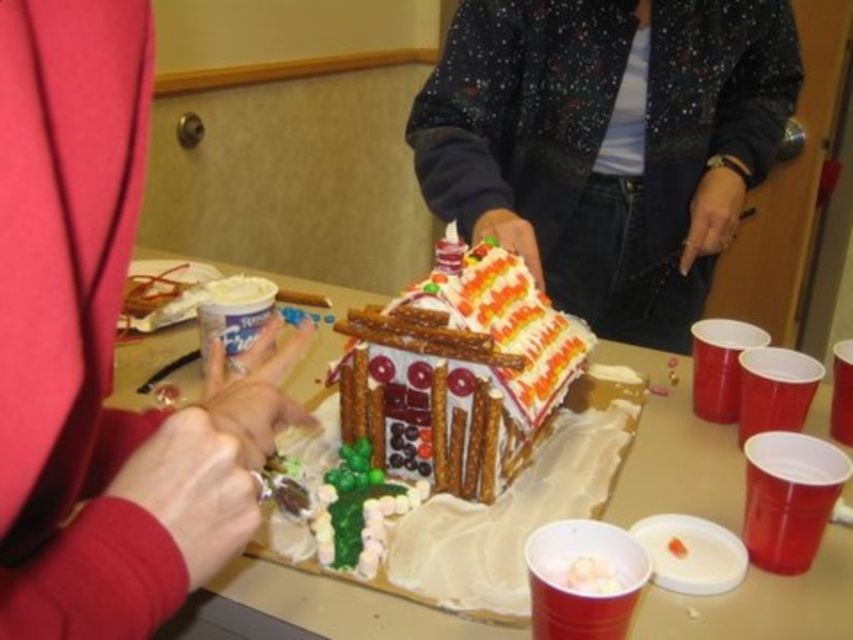
You are a child who is 1.2 meters tall and want to reach the white fondant gingerbread house at center to add more decorations. If you stand on a stool that is 30 centimeters tall, will you be able to reach it?

The white fondant gingerbread house at center is 62.27 centimeters away from the viewer. If you stand on a 30 centimeter stool, your total height would be 1.2 meters plus 0.3 meters, which equals 1.5 meters. Since 1.5 meters is greater than 62.27 centimeters, you will be able to reach the white fondant gingerbread house at center.

You are a guest at the gingerbread house construction event. You see the speckled fabric jacket at center and the white fondant gingerbread house at center. Which one is taller?

The speckled fabric jacket at center is much taller than the white fondant gingerbread house at center.

From the picture: You are organizing a gingerbread house decorating event and need to ensure there is enough space between participants. If the minimum required distance between two people is 30 inches, can the person in the matte red sweater at upper left and the person in the speckled fabric jacket at center work together without violating the safety guidelines?

The matte red sweater at upper left is 27.87 inches from the speckled fabric jacket at center. Since the required distance is 30 inches, they are currently 2.13 inches too close and need to move further apart to comply with the guidelines.